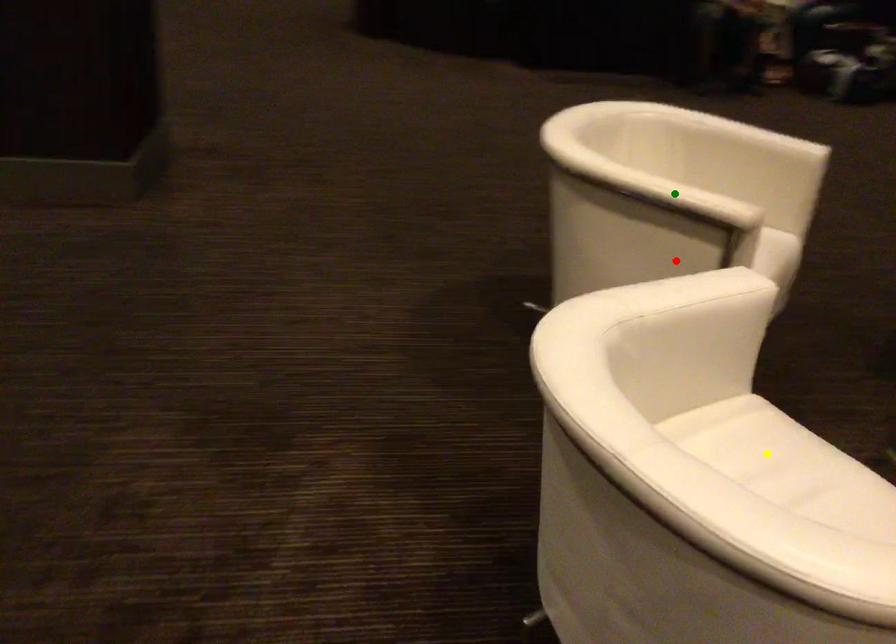
Order these from nearest to farthest:
green point, yellow point, red point

1. yellow point
2. red point
3. green point